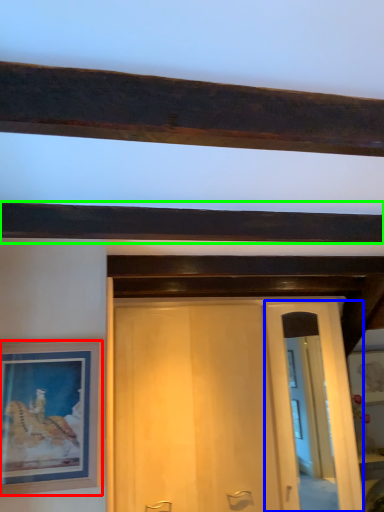
Question: Which object is positioned closest to picture frame (highlighted by a red box)? Select from glass door (highlighted by a blue box) and plank (highlighted by a green box).

Choices:
 (A) glass door
 (B) plank

Answer: (B)